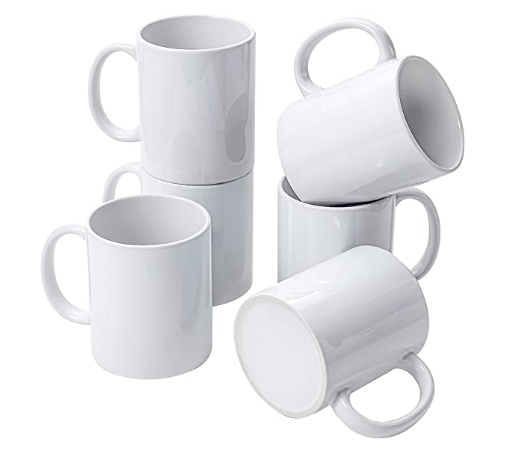
Identify the location of cups. (381, 112), (330, 228), (336, 316), (122, 296), (236, 225), (209, 127).